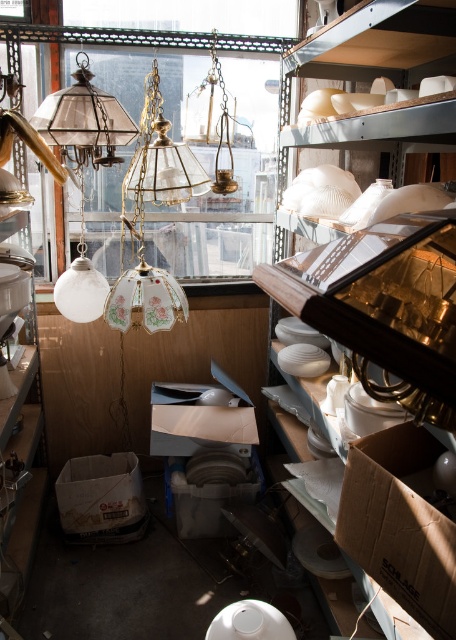
Question: Is clear glass lampshades at center smaller than brown cardboard box at lower right?

Choices:
 (A) yes
 (B) no

Answer: (B)

Question: From the image, what is the correct spatial relationship of cardboard box at center in relation to matte glass globe at left?

Choices:
 (A) below
 (B) above

Answer: (A)

Question: Does clear glass lampshades at center appear on the right side of white cardboard box at center?

Choices:
 (A) no
 (B) yes

Answer: (A)

Question: Based on their relative distances, which object is nearer to the brown cardboard box at lower right?

Choices:
 (A) white cardboard box at center
 (B) cardboard box at center
 (C) matte glass globe at left

Answer: (A)

Question: Based on their relative distances, which object is farther from the cardboard box at center?

Choices:
 (A) brown cardboard box at lower right
 (B) clear glass lampshades at center

Answer: (A)

Question: Which point is farther from the camera taking this photo?

Choices:
 (A) (82, 316)
 (B) (150, 390)
 (C) (67, 474)

Answer: (B)